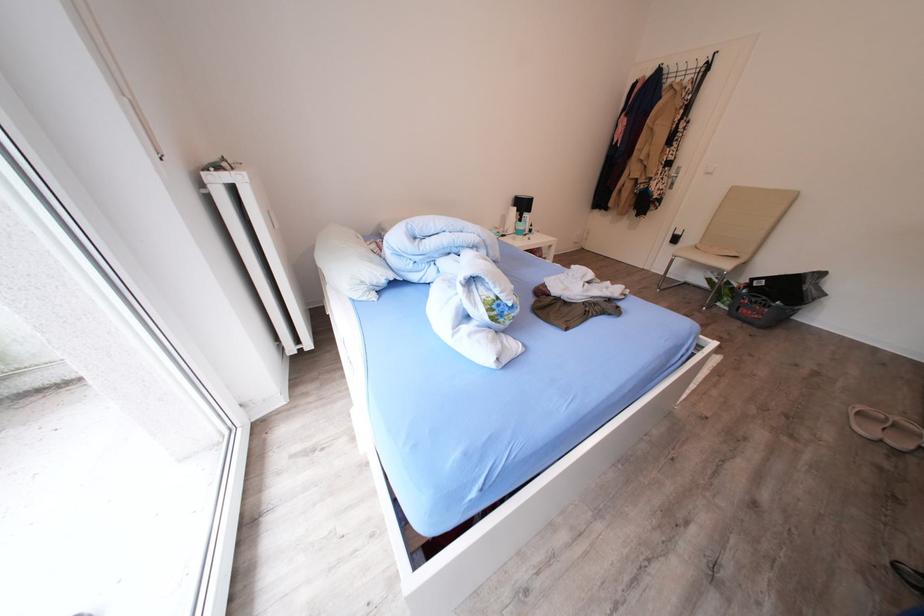
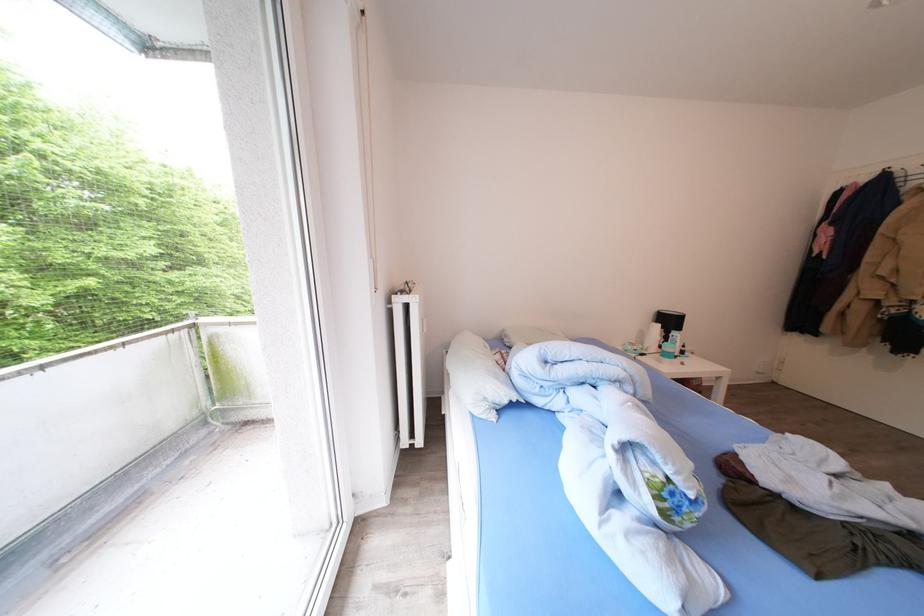
Where in the second image is the point corresponding to (531,209) from the first image?

(677, 326)